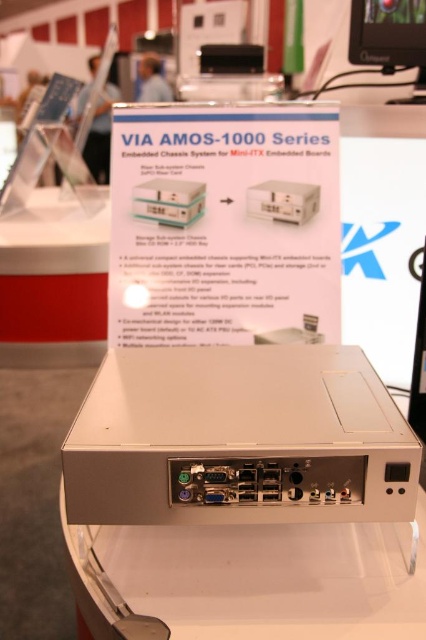
In the scene shown: Between white plastic table at center and matte black monitor at upper right, which one is positioned higher?

Positioned higher is matte black monitor at upper right.

Is point (203, 536) behind point (409, 3)?

That is False.

You are a GUI agent. You are given a task and a screenshot of the screen. Output one action in this format:
    pyautogui.click(x=<x>, y=<y>)
    Task: Click on the white plastic table at center
    This screenshot has height=640, width=426.
    Given the screenshot: What is the action you would take?
    pyautogui.click(x=249, y=580)

Can you confirm if white plastic table at lower left is positioned to the right of matte black monitor at upper right?

Incorrect, white plastic table at lower left is not on the right side of matte black monitor at upper right.

Consider the image. Can you confirm if white plastic table at lower left is positioned above matte black monitor at upper right?

Incorrect, white plastic table at lower left is not positioned above matte black monitor at upper right.

Between point (54, 248) and point (373, 44), which one is positioned behind?

The point (54, 248) is behind.

I want to click on white plastic table at lower left, so click(54, 272).

Does white plastic table at center have a larger size compared to white plastic table at lower left?

No, white plastic table at center is not bigger than white plastic table at lower left.

From the picture: Who is taller, white plastic table at center or white plastic table at lower left?

white plastic table at lower left

Is point (388, 564) farther from viewer compared to point (72, 216)?

No, it is not.

Find the location of `white plastic table at center`. white plastic table at center is located at coordinates (249, 580).